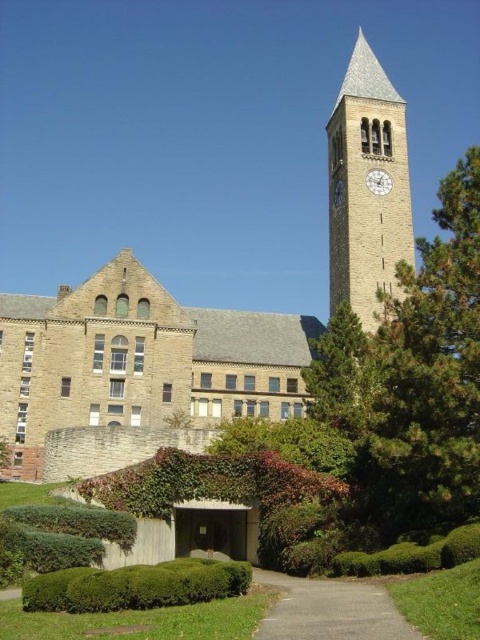
You are standing in front of the historic stone building and looking towards the sandstone clock tower at upper right. Can you see the green leafy hedge at lower center from this viewpoint?

The green leafy hedge at lower center is behind the sandstone clock tower at upper right, so it is obstructed from your current viewpoint. You cannot see the green leafy hedge at lower center from here.